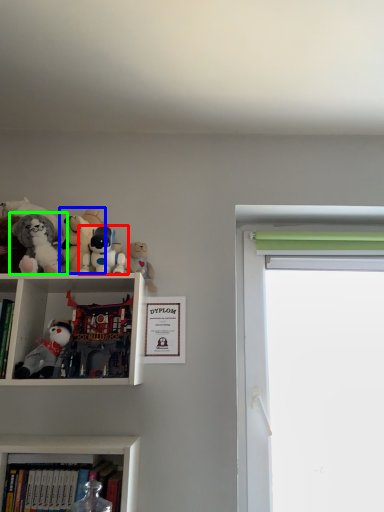
Question: Based on their relative distances, which object is nearer to toy (highlighted by a red box)? Choose from toy (highlighted by a blue box) and toy (highlighted by a green box).

Choices:
 (A) toy
 (B) toy

Answer: (A)